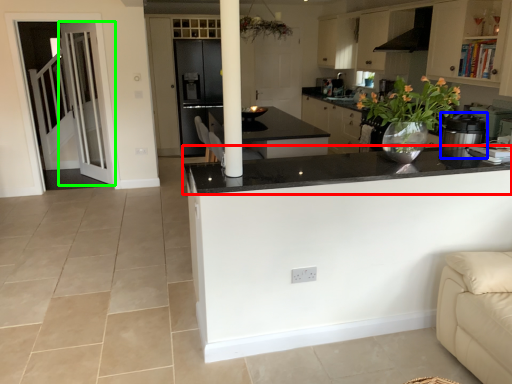
Question: Which object is the closest to the countertop (highlighted by a red box)? Choose among these: kitchen appliance (highlighted by a blue box) or door (highlighted by a green box).

Choices:
 (A) kitchen appliance
 (B) door

Answer: (A)